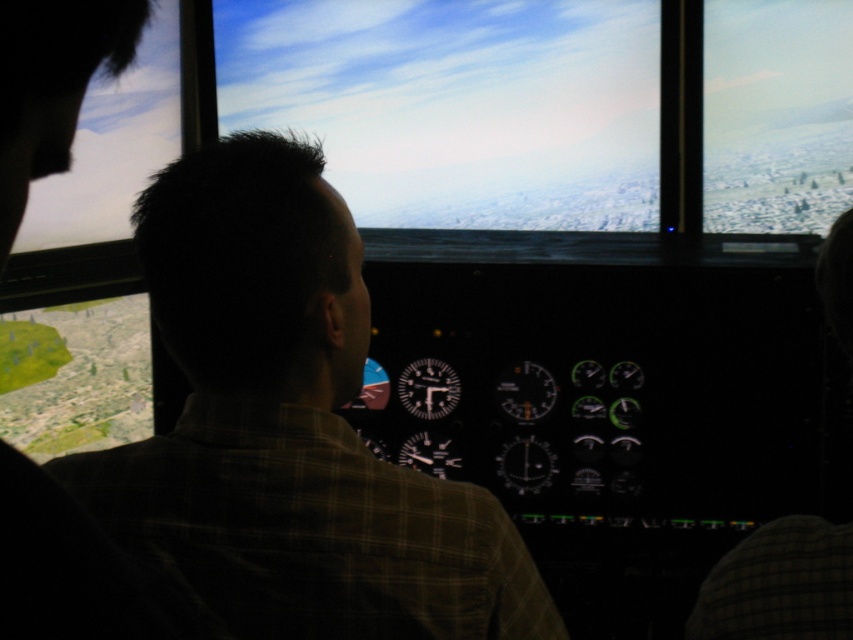
Which of these two, brown plaid shirt at center or cloudy sky at center, stands taller?

cloudy sky at center

Can you confirm if brown plaid shirt at center is shorter than cloudy sky at center?

Yes.

The image size is (853, 640). In order to click on brown plaid shirt at center in this screenshot , I will do `click(289, 429)`.